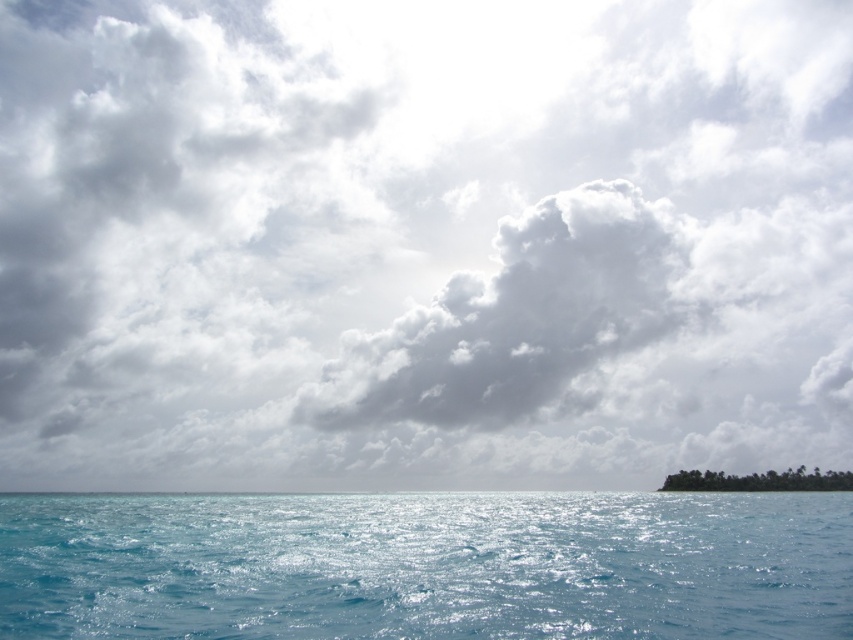
You are standing at the center of the image and want to reach the two points marked in the scene. Which point, point (845, 604) or point (421, 316), will you encounter first as you move forward?

Point (845, 604) is closer to the camera than point (421, 316), so you will encounter point (845, 604) first as you move forward.

You are an artist painting this seascape. You want to ensure the clear blue water at lower center and the white fluffy cloud at center are proportionally accurate. Which object should you make larger in your painting?

The white fluffy cloud at center should be made larger because it occupies more space than the clear blue water at lower center in the image.

You are standing on a boat in the middle of the ocean and looking at the clear blue water at lower center and the white fluffy cloud at center. Which object is positioned to the right side of the other?

The clear blue water at lower center is to the left of the white fluffy cloud at center, so the white fluffy cloud at center is positioned to the right side of the clear blue water at lower center.